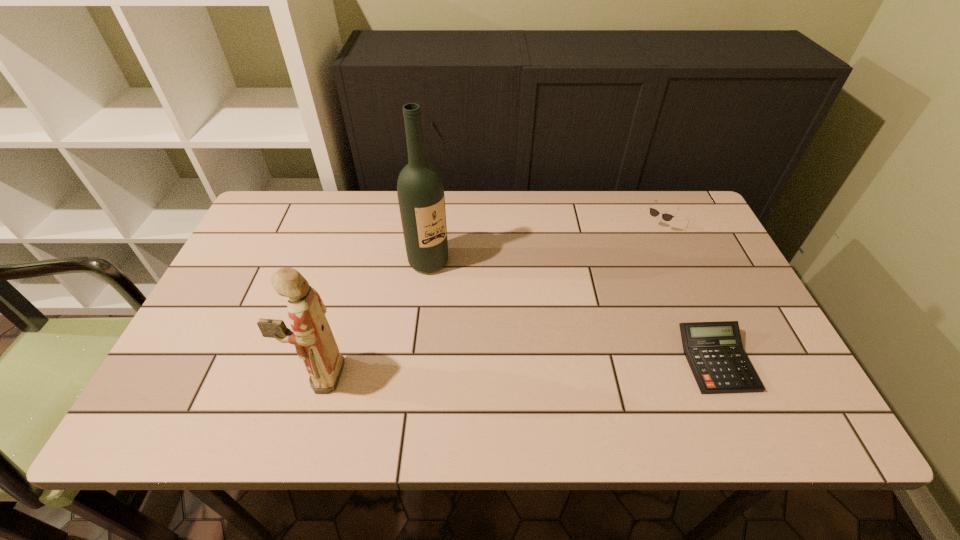
Where is `vacant space on the desktop that is between the leftmost object and the calculator and is positioned on the labeled side of the second farthest object`? The image size is (960, 540). vacant space on the desktop that is between the leftmost object and the calculator and is positioned on the labeled side of the second farthest object is located at coordinates (525, 367).

I want to click on vacant spot on the desktop that is between the figurine and the calculator and is positioned in front of the lenses of the third tallest object, so click(563, 366).